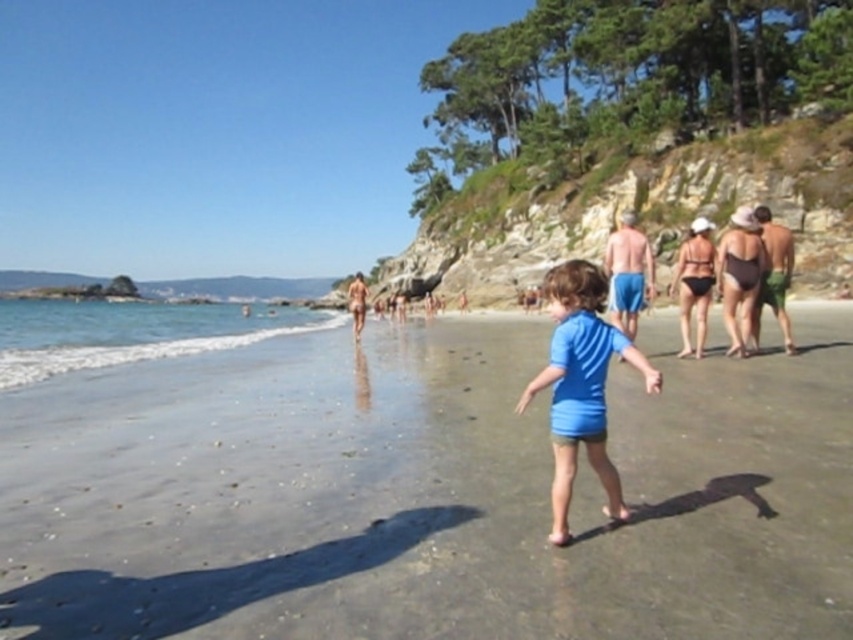
Between blue matte shirt at center and dark brown swimsuit at right, which one appears on the left side from the viewer's perspective?

blue matte shirt at center is more to the left.

The image size is (853, 640). What do you see at coordinates (581, 385) in the screenshot?
I see `blue matte shirt at center` at bounding box center [581, 385].

Is point (560, 497) closer to camera compared to point (733, 328)?

Yes, point (560, 497) is in front of point (733, 328).

This screenshot has width=853, height=640. Identify the location of blue matte shirt at center. (581, 385).

This screenshot has width=853, height=640. Describe the element at coordinates (581, 385) in the screenshot. I see `blue matte shirt at center` at that location.

The height and width of the screenshot is (640, 853). What are the coordinates of `blue matte shirt at center` in the screenshot? It's located at (581, 385).

Is blue matte shirt at center behind blue shorts at center?

No, blue matte shirt at center is closer to the viewer.

Based on the photo, is blue matte shirt at center smaller than blue shorts at center?

Yes, blue matte shirt at center is smaller than blue shorts at center.

Between point (535, 392) and point (628, 305), which one is positioned in front?

Positioned in front is point (535, 392).

Identify the location of blue matte shirt at center. Image resolution: width=853 pixels, height=640 pixels. (581, 385).